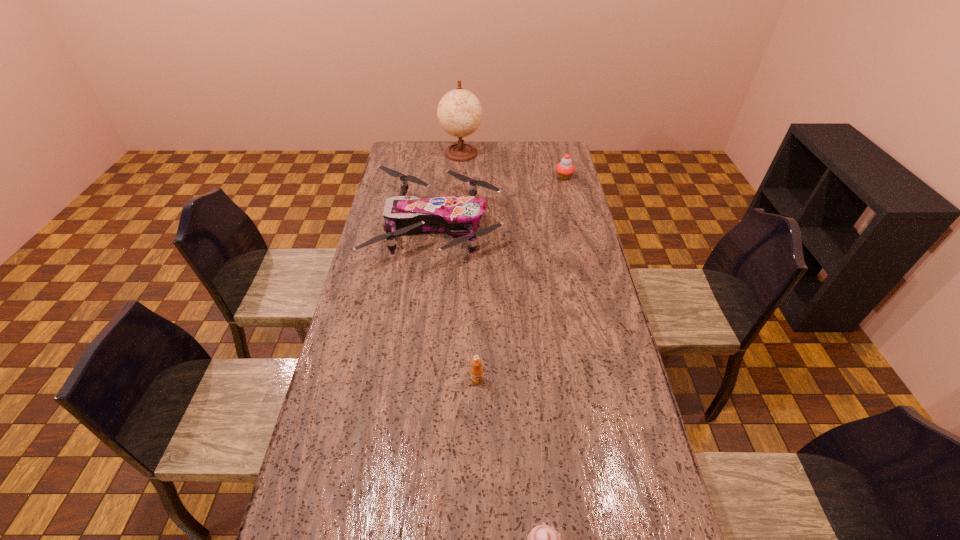
Where is `the farthest object`? the farthest object is located at coordinates (x=459, y=112).

Find the location of a particular element. the tallest object is located at coordinates (459, 112).

Locate an element on the screen. Image resolution: width=960 pixels, height=540 pixels. drone is located at coordinates (458, 215).

Identify the location of the rightmost object. (565, 169).

The image size is (960, 540). I want to click on the right cupcake, so click(x=565, y=169).

This screenshot has height=540, width=960. Identify the location of the fourth farthest object. (476, 370).

Where is `vacant space located on the surface of the globe`? The image size is (960, 540). vacant space located on the surface of the globe is located at coordinates (460, 178).

This screenshot has height=540, width=960. What are the coordinates of `vacant space located 0.090m on the front-facing side of the drone` in the screenshot? It's located at (524, 227).

At what (x,y) coordinates should I click in order to perform the action: click on vacant space located on the front of the fourth nearest object. Please return your answer as a coordinate pair (x, y). The height and width of the screenshot is (540, 960). Looking at the image, I should click on (576, 226).

You are a GUI agent. You are given a task and a screenshot of the screen. Output one action in this format:
    pyautogui.click(x=<x>, y=<y>)
    Task: Click on the free space located on the front label of the second nearest object
    
    Given the screenshot: What is the action you would take?
    pyautogui.click(x=476, y=424)